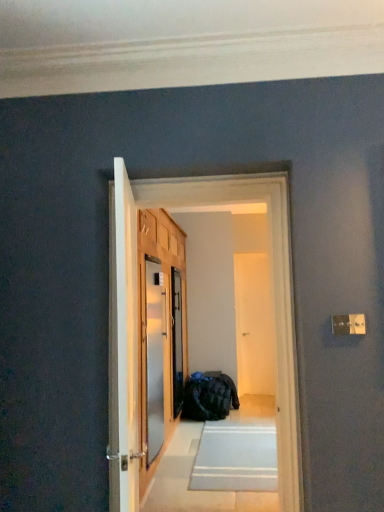
Where is `clear glass screen door at center, the second screen door when ordered from front to back`? clear glass screen door at center, the second screen door when ordered from front to back is located at coordinates (177, 342).

How much space does white glossy door at center, acting as the 1th screen door starting from the right, occupy vertically?

1.99 meters.

Describe the element at coordinates (153, 357) in the screenshot. I see `satin silver screen door at center, the 3th screen door positioned from the right` at that location.

What do you see at coordinates (123, 345) in the screenshot? I see `white glossy door at center` at bounding box center [123, 345].

I want to click on clear glass screen door at center, placed as the second screen door when sorted from right to left, so click(177, 342).

Considering the relative sizes of white glossy door at center and white glossy door at center, which ranks as the 3th screen door in left-to-right order, in the image provided, is white glossy door at center shorter than white glossy door at center, which ranks as the 3th screen door in left-to-right order,?

Correct, white glossy door at center is not as tall as white glossy door at center, which ranks as the 3th screen door in left-to-right order.

Looking at this image, can you tell me how much white glossy door at center and white glossy door at center, which ranks as the 3th screen door in left-to-right order, differ in facing direction?

white glossy door at center and white glossy door at center, which ranks as the 3th screen door in left-to-right order, are facing 100 degrees away from each other.

Considering the relative sizes of white glossy door at center and white glossy door at center, which ranks as the 3th screen door in left-to-right order, in the image provided, is white glossy door at center bigger than white glossy door at center, which ranks as the 3th screen door in left-to-right order,?

Yes.

Which object is thinner, white glossy door at center or white glossy door at center, positioned as the 3th screen door in front-to-back order?

Thinner between the two is white glossy door at center.

Who is more distant, clear glass screen door at center, placed as the second screen door when sorted from right to left, or metallic refrigerator at center?

Positioned behind is clear glass screen door at center, placed as the second screen door when sorted from right to left.

Can metallic refrigerator at center be found inside clear glass screen door at center, the second screen door positioned from the back?

No.

In the scene shown: From a real-world perspective, who is located higher, clear glass screen door at center, the second screen door when ordered from front to back, or metallic refrigerator at center?

In real-world perspective, metallic refrigerator at center is above.

Does clear glass screen door at center, the second screen door when ordered from front to back, have a greater height compared to metallic refrigerator at center?

No, clear glass screen door at center, the second screen door when ordered from front to back, is not taller than metallic refrigerator at center.

At what (x,y) coordinates should I click in order to perform the action: click on door above the white glossy door at center, the first screen door in the back-to-front sequence (from the image's perspective). Please return your answer as a coordinate pair (x, y). Looking at the image, I should click on (123, 345).

Considering the sizes of white glossy door at center, the first screen door in the back-to-front sequence, and white glossy door at center in the image, is white glossy door at center, the first screen door in the back-to-front sequence, taller or shorter than white glossy door at center?

white glossy door at center, the first screen door in the back-to-front sequence, is taller than white glossy door at center.

Are white glossy door at center, which ranks as the 3th screen door in left-to-right order, and white glossy door at center located far from each other?

Absolutely, white glossy door at center, which ranks as the 3th screen door in left-to-right order, is distant from white glossy door at center.

From a real-world perspective, is white glossy door at center, which ranks as the 3th screen door in left-to-right order, positioned over white glossy door at center based on gravity?

Actually, white glossy door at center, which ranks as the 3th screen door in left-to-right order, is physically below white glossy door at center in the real world.

Consider the image. Is satin silver screen door at center, the 3th screen door positioned from the right, far away from white glossy door at center?

Yes, satin silver screen door at center, the 3th screen door positioned from the right, is far from white glossy door at center.

Is the depth of satin silver screen door at center, which appears as the 1th screen door when viewed from the left, greater than that of white glossy door at center?

Yes, satin silver screen door at center, which appears as the 1th screen door when viewed from the left, is further from the camera.

Could you tell me if satin silver screen door at center, the third screen door positioned from the back, is turned towards white glossy door at center?

No, satin silver screen door at center, the third screen door positioned from the back, is not aimed at white glossy door at center.

Which object is positioned more to the right, satin silver screen door at center, which appears as the 1th screen door when viewed from the left, or white glossy door at center?

From the viewer's perspective, satin silver screen door at center, which appears as the 1th screen door when viewed from the left, appears more on the right side.

Which object is positioned more to the left, satin silver screen door at center, the 3th screen door positioned from the right, or metallic refrigerator at center?

From the viewer's perspective, satin silver screen door at center, the 3th screen door positioned from the right, appears more on the left side.

From a real-world perspective, is satin silver screen door at center, the 3th screen door positioned from the right, physically located above or below metallic refrigerator at center?

From a real-world perspective, satin silver screen door at center, the 3th screen door positioned from the right, is physically below metallic refrigerator at center.

How different are the orientations of satin silver screen door at center, the 3th screen door positioned from the right, and metallic refrigerator at center in degrees?

87.6 degrees.

Is white glossy door at center at the left side of satin silver screen door at center, which appears as the 1th screen door when viewed from the left?

Yes.

Considering the relative sizes of white glossy door at center and satin silver screen door at center, the 3th screen door positioned from the right, in the image provided, is white glossy door at center thinner than satin silver screen door at center, the 3th screen door positioned from the right,?

Yes, white glossy door at center is thinner than satin silver screen door at center, the 3th screen door positioned from the right.

Identify the location of the 1st screen door counting from the right side of the white glossy door at center. (153, 357).

In the scene shown: Can you confirm if clear glass screen door at center, the second screen door positioned from the back, is positioned to the left of satin silver screen door at center, which is the 1th screen door from front to back?

In fact, clear glass screen door at center, the second screen door positioned from the back, is to the right of satin silver screen door at center, which is the 1th screen door from front to back.

Between point (177, 324) and point (143, 381), which one is positioned behind?

The point (177, 324) is behind.

Identify the location of screen door that is the 1st one above the satin silver screen door at center, the third screen door positioned from the back (from a real-world perspective). The width and height of the screenshot is (384, 512). (177, 342).

In the scene shown: Can you confirm if clear glass screen door at center, the second screen door when ordered from front to back, is smaller than satin silver screen door at center, the third screen door positioned from the back?

Yes, clear glass screen door at center, the second screen door when ordered from front to back, is smaller than satin silver screen door at center, the third screen door positioned from the back.

Where is `door positioned vertically above the white glossy door at center, acting as the 1th screen door starting from the right (from a real-world perspective)`? The height and width of the screenshot is (512, 384). door positioned vertically above the white glossy door at center, acting as the 1th screen door starting from the right (from a real-world perspective) is located at coordinates (123, 345).

From a real-world perspective, which screen door is the 2nd one underneath the metallic refrigerator at center? Please provide its 2D coordinates.

[(177, 342)]

Which object lies nearer to the anchor point clear glass screen door at center, the second screen door positioned from the back, metallic refrigerator at center or white glossy door at center, the first screen door in the back-to-front sequence?

Based on the image, white glossy door at center, the first screen door in the back-to-front sequence, appears to be nearer to clear glass screen door at center, the second screen door positioned from the back.

Considering their positions, is white glossy door at center, which ranks as the 3th screen door in left-to-right order, positioned closer to clear glass screen door at center, the second screen door positioned from the back, than metallic refrigerator at center?

white glossy door at center, which ranks as the 3th screen door in left-to-right order, is closer to clear glass screen door at center, the second screen door positioned from the back.

Considering their positions, is metallic refrigerator at center positioned further to white glossy door at center, which ranks as the 3th screen door in left-to-right order, than satin silver screen door at center, which is the 1th screen door from front to back?

The object further to white glossy door at center, which ranks as the 3th screen door in left-to-right order, is metallic refrigerator at center.

Considering their positions, is satin silver screen door at center, which is the 1th screen door from front to back, positioned closer to clear glass screen door at center, the second screen door positioned from the back, than white glossy door at center?

satin silver screen door at center, which is the 1th screen door from front to back, lies closer to clear glass screen door at center, the second screen door positioned from the back, than the other object.

Estimate the real-world distances between objects in this image. Which object is closer to white glossy door at center, clear glass screen door at center, the second screen door from the left, or satin silver screen door at center, the 3th screen door positioned from the right?

satin silver screen door at center, the 3th screen door positioned from the right.

Which object lies nearer to the anchor point metallic refrigerator at center, white glossy door at center, the first screen door in the back-to-front sequence, or clear glass screen door at center, the second screen door from the left?

clear glass screen door at center, the second screen door from the left, is closer to metallic refrigerator at center.

Based on the photo, looking at the image, which one is located further to clear glass screen door at center, the second screen door from the left, white glossy door at center or metallic refrigerator at center?

metallic refrigerator at center is positioned further to the anchor clear glass screen door at center, the second screen door from the left.

Based on the photo, from the image, which object appears to be nearer to satin silver screen door at center, the 3th screen door positioned from the right, metallic refrigerator at center or clear glass screen door at center, the second screen door when ordered from front to back?

clear glass screen door at center, the second screen door when ordered from front to back, is positioned closer to the anchor satin silver screen door at center, the 3th screen door positioned from the right.

Where is `screen door between white glossy door at center and clear glass screen door at center, placed as the second screen door when sorted from right to left, along the z-axis`? The height and width of the screenshot is (512, 384). screen door between white glossy door at center and clear glass screen door at center, placed as the second screen door when sorted from right to left, along the z-axis is located at coordinates (153, 357).

Find the location of a particular element. This screenshot has width=384, height=512. corridor positioned between white glossy door at center and clear glass screen door at center, the second screen door from the left, from near to far is located at coordinates (137, 302).

Identify the location of screen door between satin silver screen door at center, which appears as the 1th screen door when viewed from the left, and white glossy door at center, the first screen door in the back-to-front sequence, in the front-back direction. (177, 342).

What are the coordinates of `corridor between white glossy door at center and white glossy door at center, acting as the 1th screen door starting from the right, along the z-axis` in the screenshot? It's located at (137, 302).